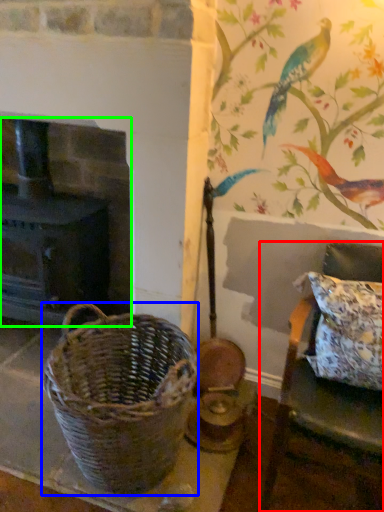
Question: Which object is the farthest from furniture (highlighted by a red box)? Choose among these: picnic basket (highlighted by a blue box) or fireplace (highlighted by a green box).

Choices:
 (A) picnic basket
 (B) fireplace

Answer: (B)